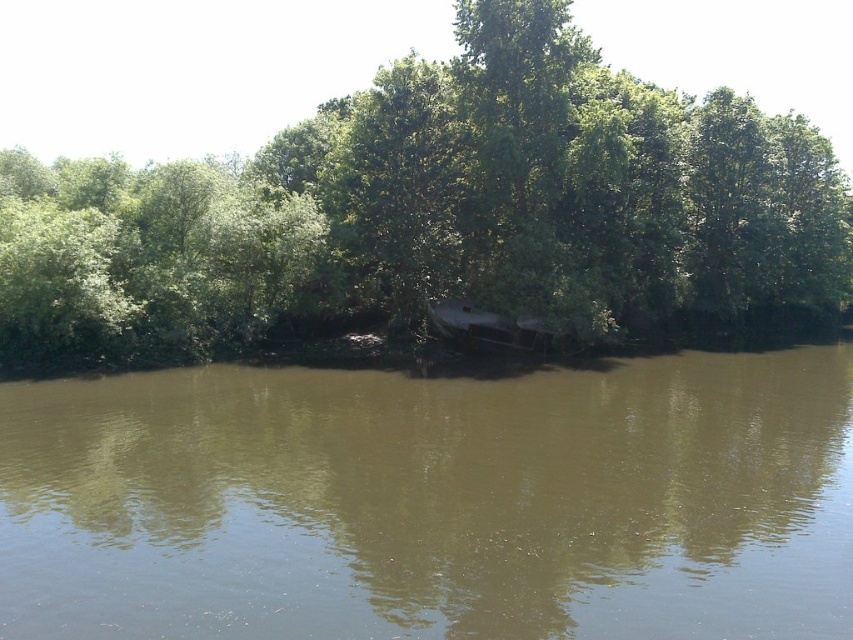
You are standing at the riverbank and want to reach a specific location marked by point A at coordinates point A at point (651, 518) and point B at point (451, 312). Which point is closer to you from your current position?

Point A at point (651, 518) is in front of point B at point (451, 312), so point A at point (651, 518) is closer to you.

You are planning to set up a small campsite near the dark brown wood boat at center. Considering the green leafy tree at center is 75.18 feet away, is this distance within a reasonable walking distance for accessing the tree for shade?

The distance between the green leafy tree at center and the dark brown wood boat at center is 75.18 feet. This distance is reasonable for walking to the tree for shade as it is a moderate walk, but not extremely close.